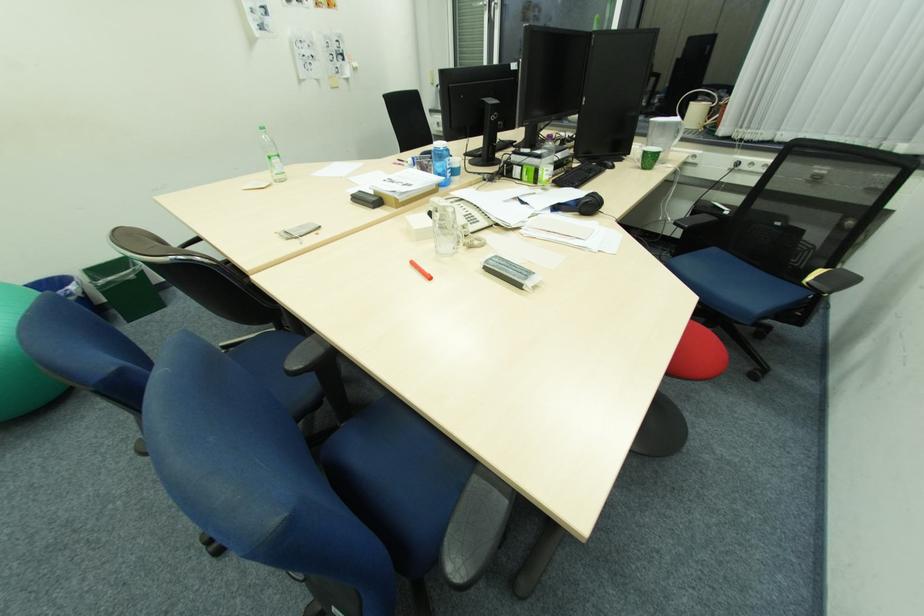
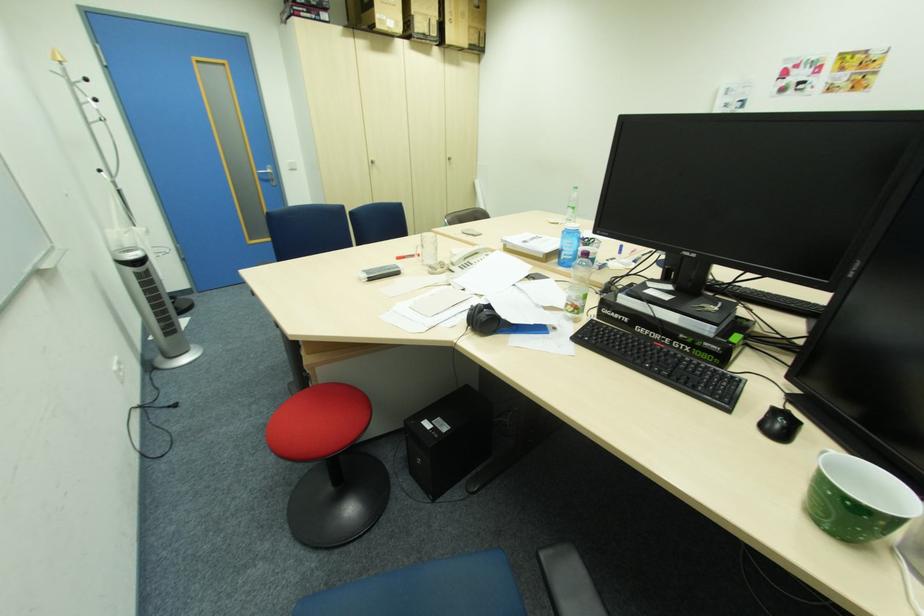
Where in the second image is the point corresponding to pixel 280 161 from the first image?

(574, 209)